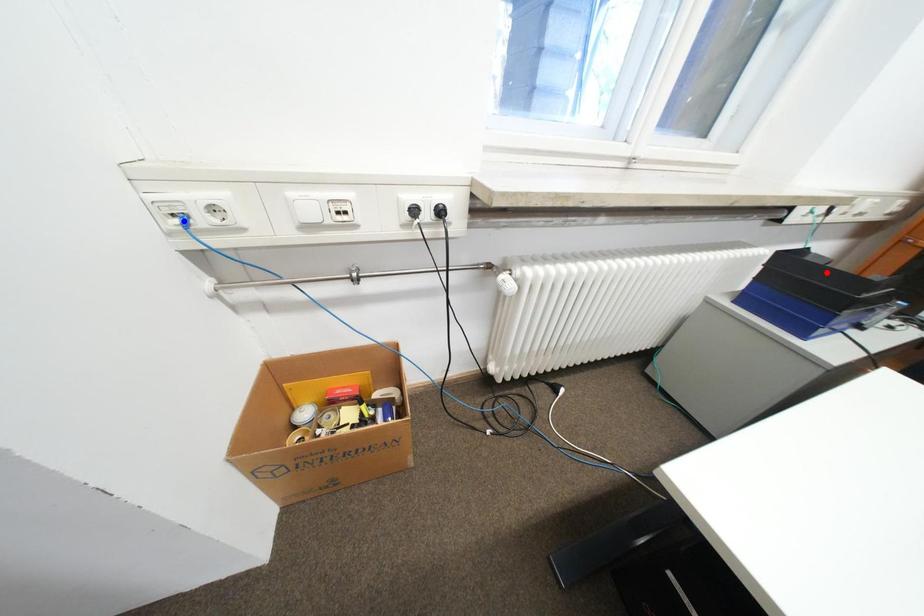
Question: Two points are marked on the image. Which point is closer to the camera?

Choices:
 (A) Blue point is closer.
 (B) Red point is closer.

Answer: (A)